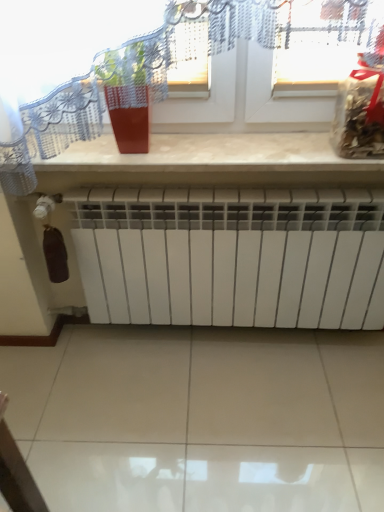
Question: Does beige marble counter at upper center turn towards translucent plastic bag at upper right?

Choices:
 (A) yes
 (B) no

Answer: (B)

Question: Considering the relative sizes of beige marble counter at upper center and translucent plastic bag at upper right in the image provided, is beige marble counter at upper center smaller than translucent plastic bag at upper right?

Choices:
 (A) yes
 (B) no

Answer: (B)

Question: From the image's perspective, is beige marble counter at upper center over translucent plastic bag at upper right?

Choices:
 (A) yes
 (B) no

Answer: (B)

Question: Can you confirm if beige marble counter at upper center is shorter than translucent plastic bag at upper right?

Choices:
 (A) no
 (B) yes

Answer: (B)

Question: Is beige marble counter at upper center closer to the viewer compared to translucent plastic bag at upper right?

Choices:
 (A) yes
 (B) no

Answer: (B)

Question: Is beige marble counter at upper center next to translucent plastic bag at upper right and touching it?

Choices:
 (A) yes
 (B) no

Answer: (B)

Question: Would you say matte red pot at upper center is a long distance from beige marble counter at upper center?

Choices:
 (A) yes
 (B) no

Answer: (B)

Question: Can you confirm if matte red pot at upper center is positioned to the right of beige marble counter at upper center?

Choices:
 (A) no
 (B) yes

Answer: (A)

Question: Is matte red pot at upper center looking in the opposite direction of beige marble counter at upper center?

Choices:
 (A) no
 (B) yes

Answer: (A)

Question: Is matte red pot at upper center wider than beige marble counter at upper center?

Choices:
 (A) no
 (B) yes

Answer: (A)

Question: Considering the relative positions of matte red pot at upper center and beige marble counter at upper center in the image provided, is matte red pot at upper center in front of beige marble counter at upper center?

Choices:
 (A) yes
 (B) no

Answer: (A)

Question: Considering the relative sizes of matte red pot at upper center and beige marble counter at upper center in the image provided, is matte red pot at upper center taller than beige marble counter at upper center?

Choices:
 (A) no
 (B) yes

Answer: (B)

Question: Can you confirm if translucent plastic bag at upper right is shorter than white matte radiator at lower center?

Choices:
 (A) no
 (B) yes

Answer: (B)